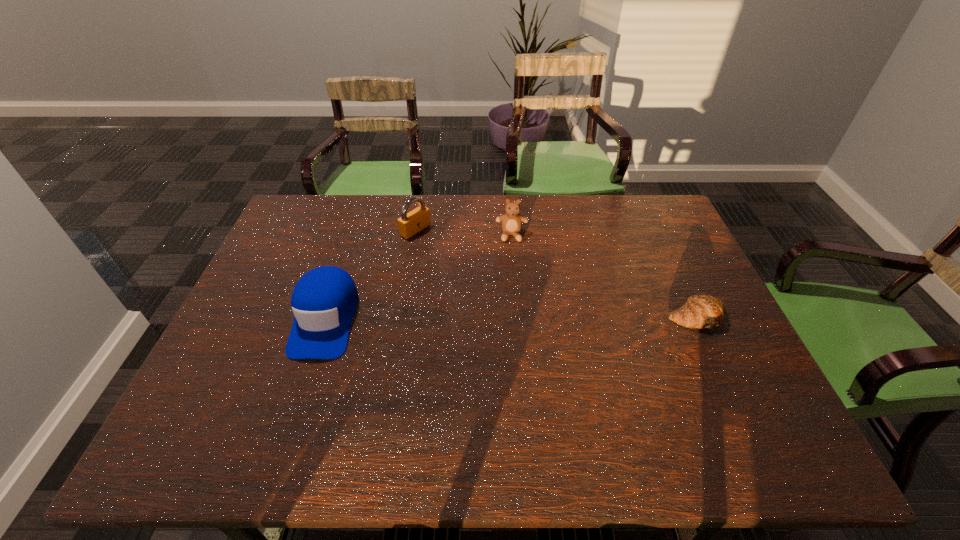
Where is `free space between the crescent roll and the leftmost object`? free space between the crescent roll and the leftmost object is located at coordinates (511, 318).

The width and height of the screenshot is (960, 540). Identify the location of free area in between the leftmost object and the rightmost object. (511, 318).

The width and height of the screenshot is (960, 540). What are the coordinates of `vacant area that lies between the crescent roll and the padlock` in the screenshot? It's located at (556, 273).

You are a GUI agent. You are given a task and a screenshot of the screen. Output one action in this format:
    pyautogui.click(x=<x>, y=<y>)
    Task: Click on the free space between the teddy bear and the leftmost object
    This screenshot has height=540, width=960.
    Given the screenshot: What is the action you would take?
    pyautogui.click(x=419, y=277)

Where is `empty space between the third object from left to right and the third object from right to left`? The width and height of the screenshot is (960, 540). empty space between the third object from left to right and the third object from right to left is located at coordinates (464, 233).

Where is `vacant region between the leftmost object and the teddy bear`? vacant region between the leftmost object and the teddy bear is located at coordinates (419, 277).

Locate an element on the screen. free space between the teddy bear and the crescent roll is located at coordinates (604, 276).

This screenshot has height=540, width=960. In order to click on empty location between the baseball cap and the padlock in this screenshot , I will do `click(371, 274)`.

The height and width of the screenshot is (540, 960). I want to click on empty space between the second object from left to right and the teddy bear, so click(x=464, y=233).

Find the location of a particular element. vacant area between the padlock and the teddy bear is located at coordinates (464, 233).